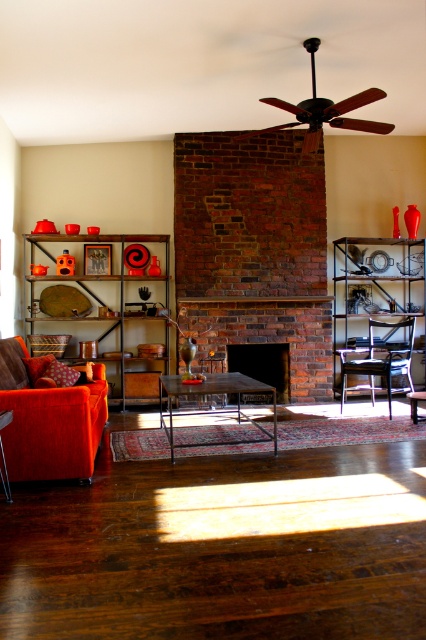
Question: Estimate the real-world distances between objects in this image. Which object is closer to the metallic black bookshelf at center-right?

Choices:
 (A) metallic orange bookshelf at left
 (B) metallic/textured coffee table at center
 (C) brick fireplace at center
 (D) velvet orange couch at lower left

Answer: (C)

Question: Does metallic black bookshelf at center-right have a lesser width compared to matte black chair at center?

Choices:
 (A) yes
 (B) no

Answer: (B)

Question: Does metallic black bookshelf at center-right have a larger size compared to brick fireplace at center?

Choices:
 (A) yes
 (B) no

Answer: (A)

Question: Considering the real-world distances, which object is farthest from the metallic black bookshelf at center-right?

Choices:
 (A) velvet orange couch at lower left
 (B) matte black chair at center
 (C) metallic orange bookshelf at left

Answer: (A)

Question: Based on their relative distances, which object is farther from the brick fireplace at center?

Choices:
 (A) metallic black bookshelf at center-right
 (B) matte black chair at center

Answer: (A)

Question: Where is velvet orange couch at lower left located in relation to matte black chair at center in the image?

Choices:
 (A) above
 (B) below

Answer: (B)